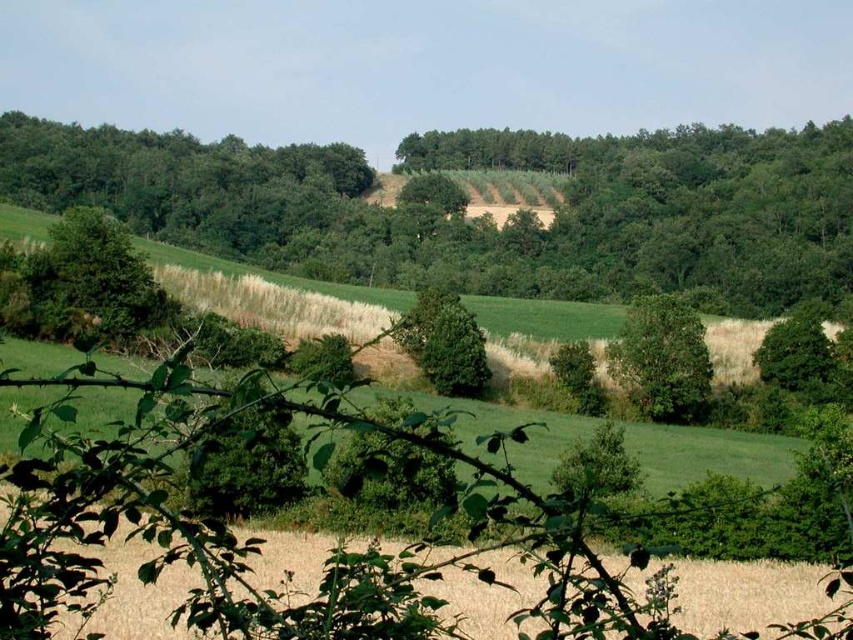
Question: Does green leafy tree at upper center have a smaller size compared to green leafy tree at center?

Choices:
 (A) yes
 (B) no

Answer: (B)

Question: Among these points, which one is nearest to the camera?

Choices:
 (A) (672, 385)
 (B) (785, 355)

Answer: (A)

Question: Which of the following is the farthest from the observer?

Choices:
 (A) (163, 308)
 (B) (805, 353)

Answer: (B)

Question: Is green leafy tree at left behind green leafy tree at center?

Choices:
 (A) yes
 (B) no

Answer: (B)

Question: Is green leafy tree at upper center positioned in front of green leafy tree at center?

Choices:
 (A) yes
 (B) no

Answer: (B)

Question: Which of the following is the farthest from the observer?

Choices:
 (A) green leafy tree at center-right
 (B) green leafy tree at upper center
 (C) green leafy tree at left

Answer: (B)